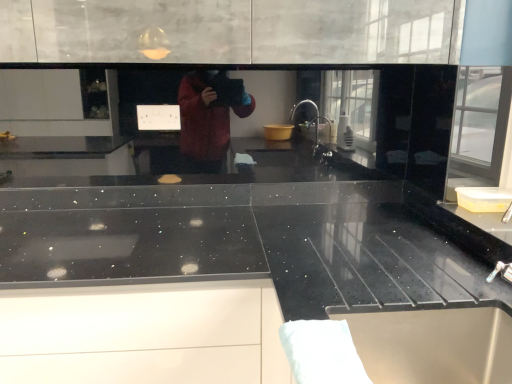
Question: Should I look upward or downward to see black granite countertop at lower left?

Choices:
 (A) down
 (B) up

Answer: (A)